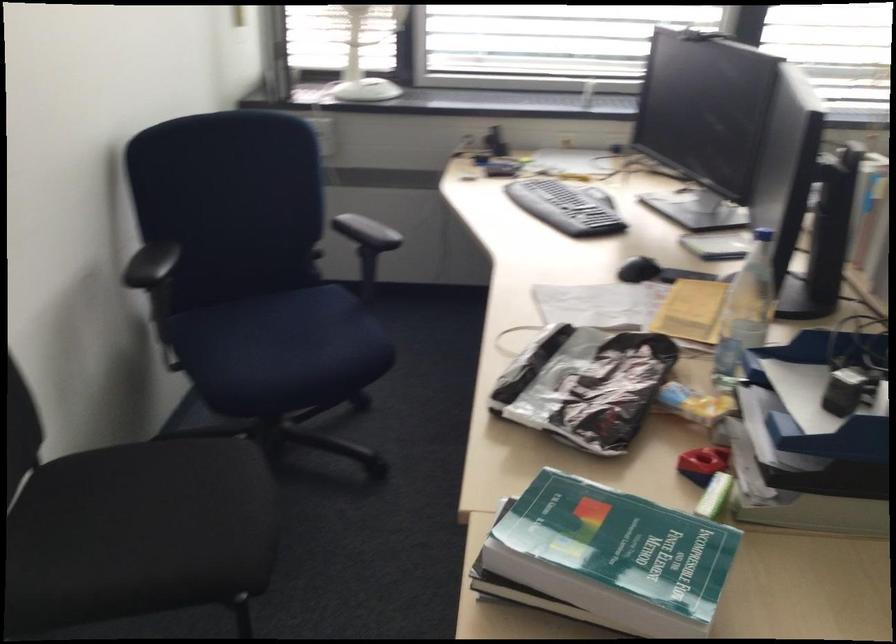
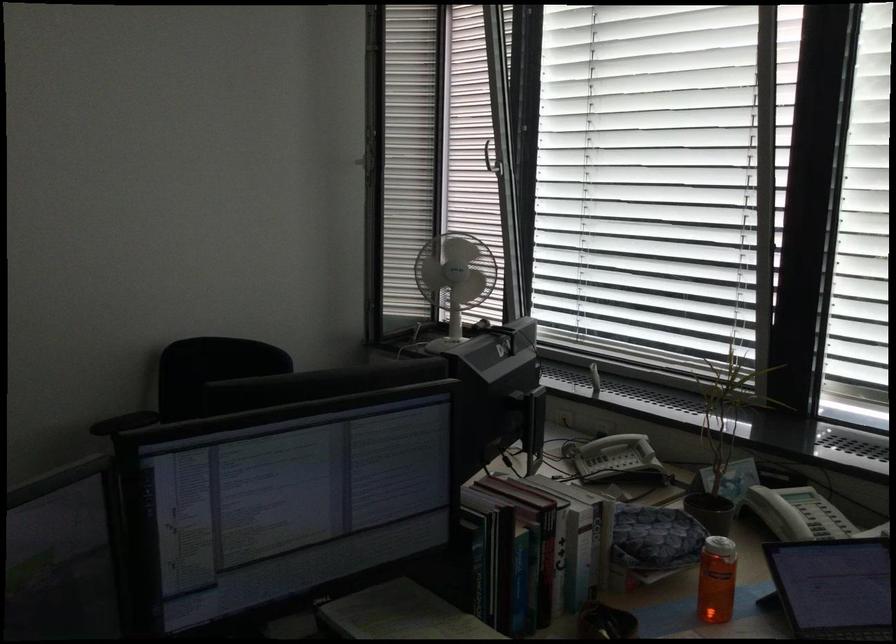
Question: I am providing you with two images of the same scene from different viewpoints. After the viewpoint changes to image2, which objects are now occluded?

Choices:
 (A) silver window handle
 (B) magazine on rack
 (C) orange water bottle
 (D) blue chair sitting surface

Answer: (D)